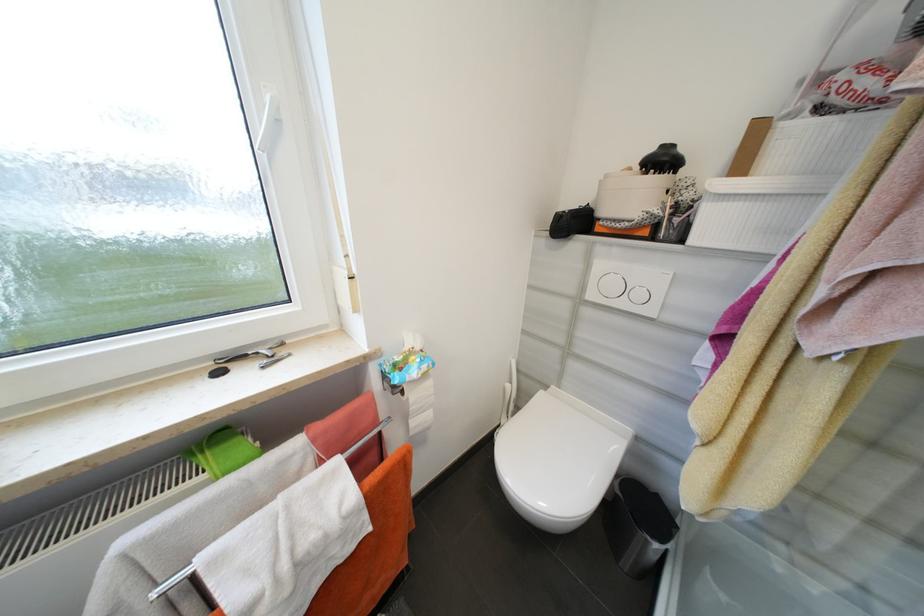
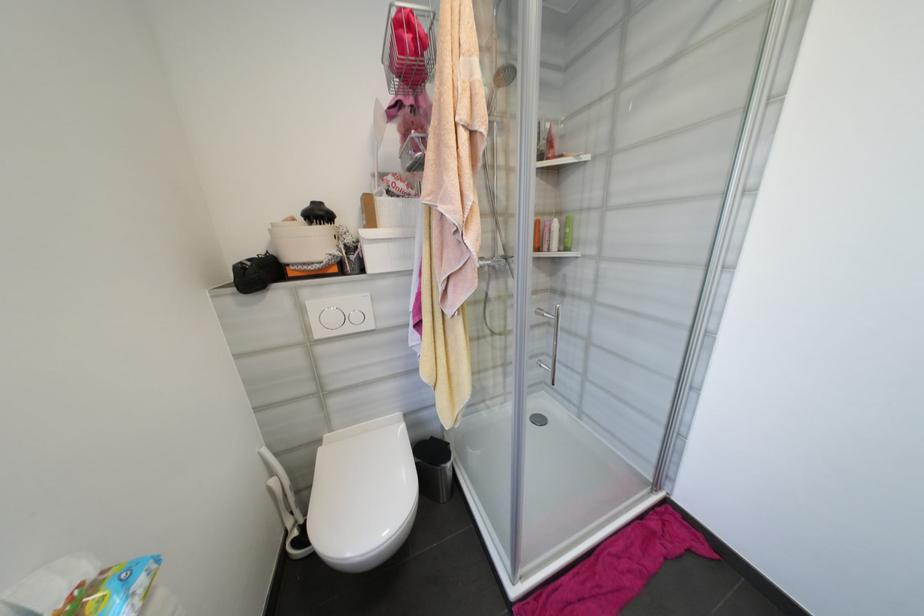
Find the pixel in the second image that matches pixel 663 498 in the first image.

(438, 440)